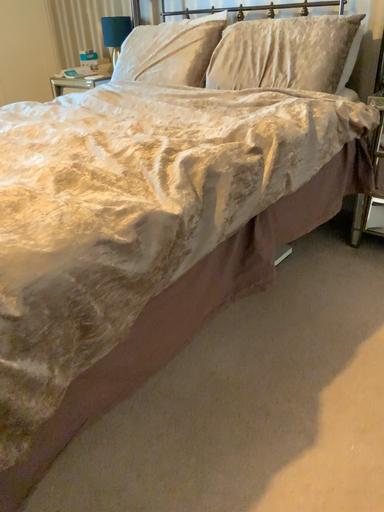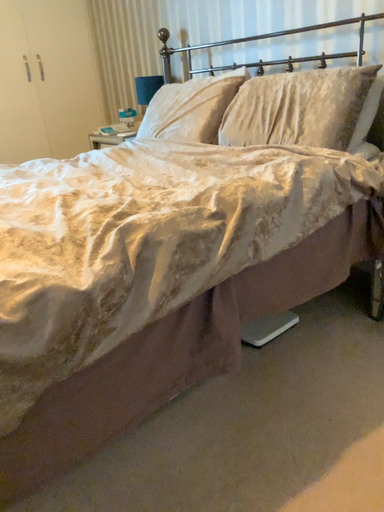
Question: Which way did the camera rotate in the video?

Choices:
 (A) rotated right
 (B) rotated left

Answer: (B)